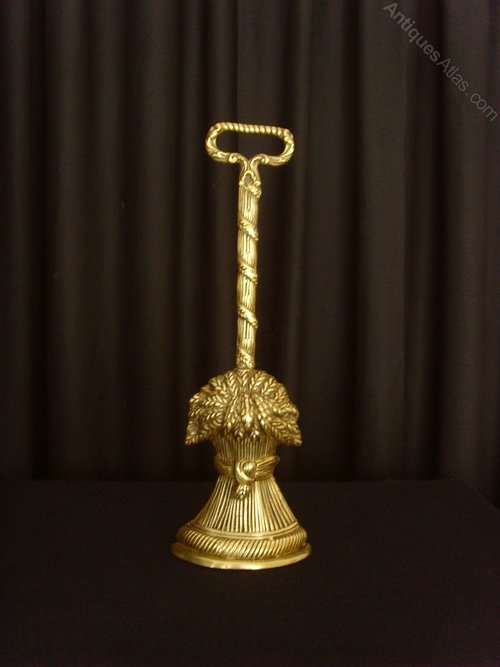
Show me all visible where curtains meet floor in the image. Your answer should be formatted as a list of tuples, i.e. [(x1, y1), (x2, y2), ...], where each tuple contains the x and y coordinates of a point satisfying the conditions above.

[(164, 480)]